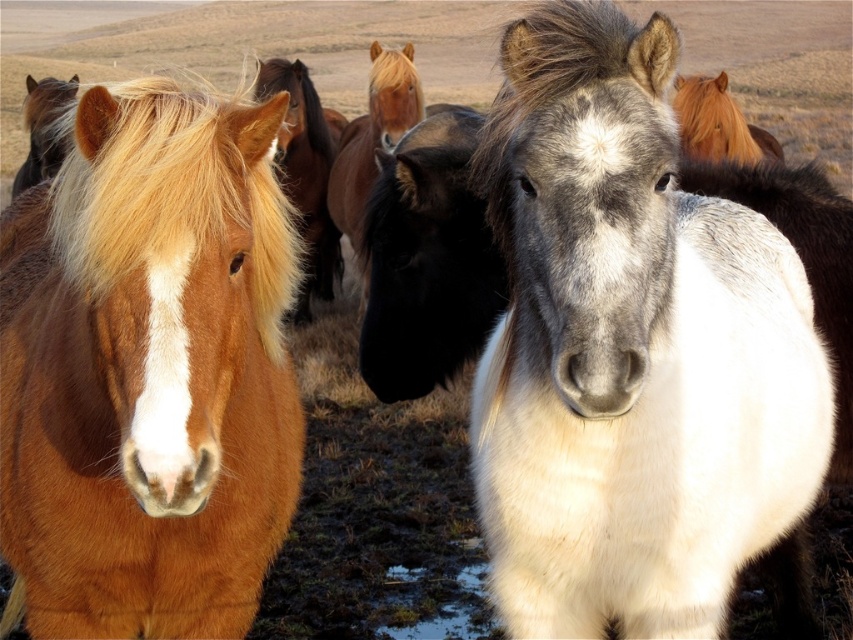
Is white-gray fur horse at center in front of shiny brown mane at center?

Yes.

Is white-gray fur horse at center above shiny brown mane at center?

Actually, white-gray fur horse at center is below shiny brown mane at center.

This screenshot has width=853, height=640. Find the location of `white-gray fur horse at center`. white-gray fur horse at center is located at coordinates (631, 349).

The height and width of the screenshot is (640, 853). In order to click on white-gray fur horse at center in this screenshot , I will do `click(631, 349)`.

Who is shorter, shiny brown horse at left or shiny brown mane at center?

shiny brown horse at left

Between shiny brown horse at left and shiny brown mane at center, which one appears on the right side from the viewer's perspective?

shiny brown mane at center is more to the right.

The width and height of the screenshot is (853, 640). What do you see at coordinates (148, 371) in the screenshot?
I see `shiny brown horse at left` at bounding box center [148, 371].

You are a GUI agent. You are given a task and a screenshot of the screen. Output one action in this format:
    pyautogui.click(x=<x>, y=<y>)
    Task: Click on the shiny brown horse at left
    
    Given the screenshot: What is the action you would take?
    pyautogui.click(x=148, y=371)

Where is `white-gray fur horse at center`? The width and height of the screenshot is (853, 640). white-gray fur horse at center is located at coordinates (631, 349).